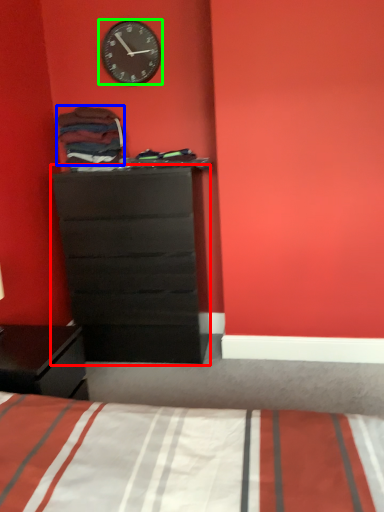
Question: Which object is the closest to the chest of drawers (highlighted by a red box)? Choose among these: clothing (highlighted by a blue box) or wall clock (highlighted by a green box).

Choices:
 (A) clothing
 (B) wall clock

Answer: (A)